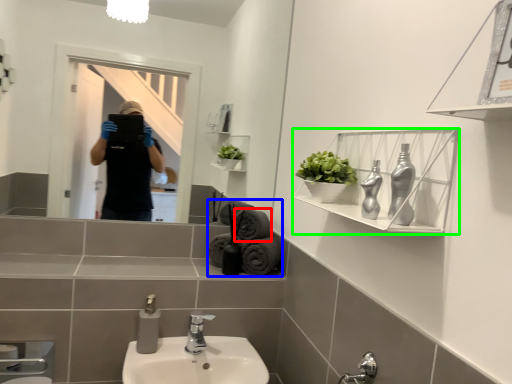
Question: Considering the real-world distances, which object is farthest from bath towel (highlighted by a red box)? bath towel (highlighted by a blue box) or shelf (highlighted by a green box)?

Choices:
 (A) bath towel
 (B) shelf

Answer: (B)